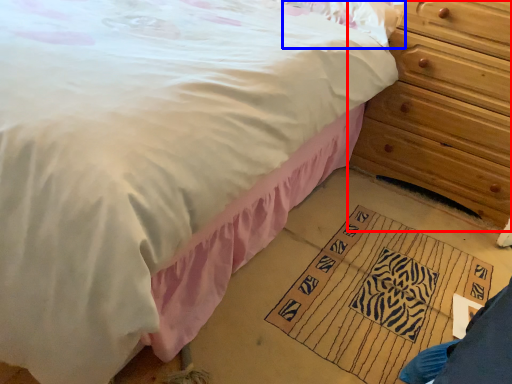
Question: Among these objects, which one is farthest to the camera, chest of drawers (highlighted by a red box) or pillow (highlighted by a blue box)?

Choices:
 (A) chest of drawers
 (B) pillow

Answer: (B)